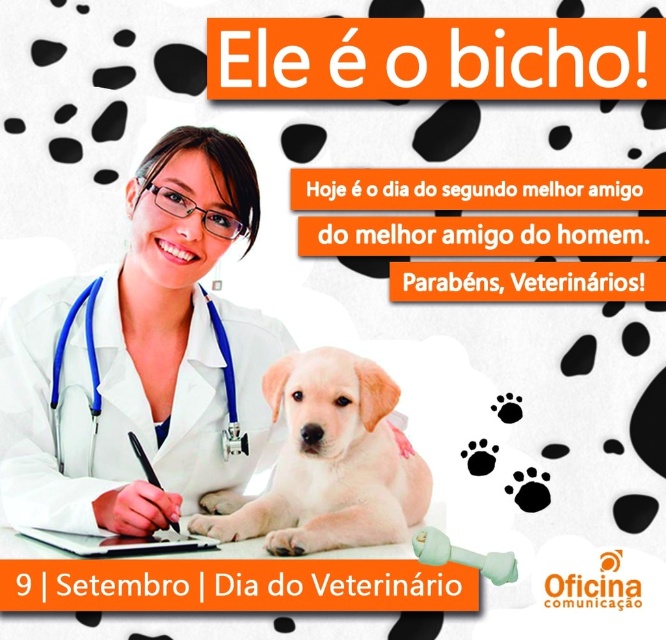
Based on the scene described, can you determine which object is larger between the light brown fur puppy at center and the blue fabric stethoscope at lower left?

The light brown fur puppy at center is bigger than the blue fabric stethoscope at lower left according to the description.

You are designing a promotional poster for Veterinarian Day. The scene includes a veterinarian wearing a white lab coat at center and a light brown fur puppy at center. Which object in the poster takes up more space?

The white lab coat at center is bigger than the light brown fur puppy at center, so it takes up more space in the poster.